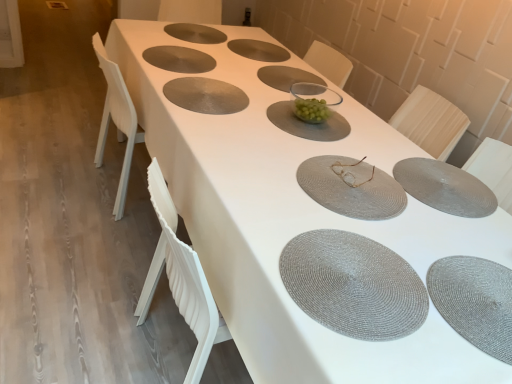
Question: Is the depth of matte gray placemat at center, the seventh tableware when ordered from top to bottom, greater than that of gray woven placemat at center?

Choices:
 (A) no
 (B) yes

Answer: (B)

Question: From the image's perspective, is matte gray placemat at center, the seventh tableware when ordered from top to bottom, under gray woven placemat at center?

Choices:
 (A) no
 (B) yes

Answer: (A)

Question: Does matte gray placemat at center, the seventh tableware when ordered from top to bottom, appear on the right side of gray woven placemat at center?

Choices:
 (A) yes
 (B) no

Answer: (A)

Question: From the image's perspective, does matte gray placemat at center, the seventh tableware when ordered from top to bottom, appear higher than gray woven placemat at center?

Choices:
 (A) no
 (B) yes

Answer: (B)

Question: Does matte gray placemat at center, the seventh tableware when ordered from top to bottom, have a greater height compared to gray woven placemat at center?

Choices:
 (A) no
 (B) yes

Answer: (B)

Question: Is matte gray placemat at center, which is counted as the third tableware, starting from the bottom, not within gray woven placemat at center?

Choices:
 (A) no
 (B) yes

Answer: (B)

Question: Considering the relative sizes of gray woven placemat at center and green glass bowl at center, positioned as the 5th tableware in top-to-bottom order, in the image provided, is gray woven placemat at center wider than green glass bowl at center, positioned as the 5th tableware in top-to-bottom order,?

Choices:
 (A) no
 (B) yes

Answer: (B)

Question: Can you confirm if gray woven placemat at center is shorter than green glass bowl at center, arranged as the 5th tableware when ordered from the bottom?

Choices:
 (A) no
 (B) yes

Answer: (A)

Question: Is gray woven placemat at center to the right of green glass bowl at center, arranged as the 5th tableware when ordered from the bottom, from the viewer's perspective?

Choices:
 (A) no
 (B) yes

Answer: (B)

Question: Is gray woven placemat at center bigger than green glass bowl at center, arranged as the 5th tableware when ordered from the bottom?

Choices:
 (A) yes
 (B) no

Answer: (A)

Question: From a real-world perspective, is gray woven placemat at center positioned over green glass bowl at center, positioned as the 5th tableware in top-to-bottom order, based on gravity?

Choices:
 (A) yes
 (B) no

Answer: (A)

Question: Can we say gray woven placemat at center lies outside green glass bowl at center, positioned as the 5th tableware in top-to-bottom order?

Choices:
 (A) yes
 (B) no

Answer: (A)

Question: Could you tell me if matte gray placemat at upper center, which ranks as the eighth tableware in bottom-to-top order, is facing green glass bowl at center, positioned as the 5th tableware in top-to-bottom order?

Choices:
 (A) yes
 (B) no

Answer: (B)